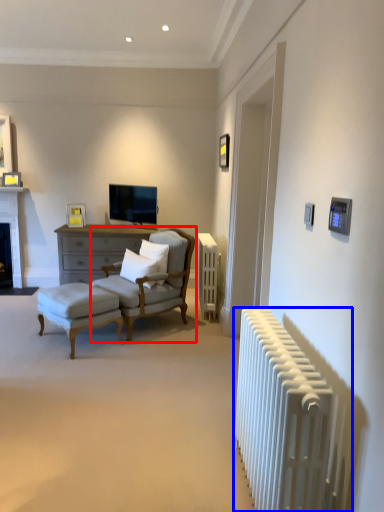
Question: Which object appears farthest to the camera in this image, chair (highlighted by a red box) or radiator (highlighted by a blue box)?

Choices:
 (A) chair
 (B) radiator

Answer: (A)